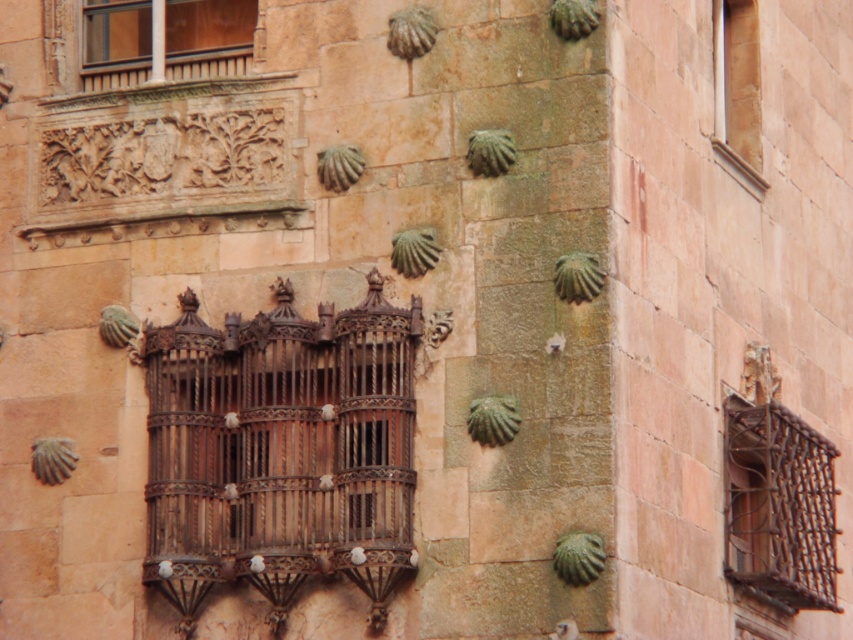
Question: From the image, what is the correct spatial relationship of rusty metal balcony at right in relation to matte brown wood at upper right?

Choices:
 (A) left
 (B) right

Answer: (A)

Question: Which object is farther from the camera taking this photo?

Choices:
 (A) rusty metal balcony at right
 (B) matte brown wood at upper right

Answer: (B)

Question: Among these points, which one is farthest from the camera?

Choices:
 (A) (831, 570)
 (B) (718, 116)

Answer: (A)

Question: Is rusty metal balcony at right positioned behind matte glass window at upper left?

Choices:
 (A) no
 (B) yes

Answer: (A)

Question: Where is rusty metal balcony at right located in relation to matte glass window at upper left in the image?

Choices:
 (A) right
 (B) left

Answer: (A)

Question: Which point appears farthest from the camera in this image?

Choices:
 (A) pos(753,472)
 (B) pos(751,177)
 (C) pos(231,42)

Answer: (B)